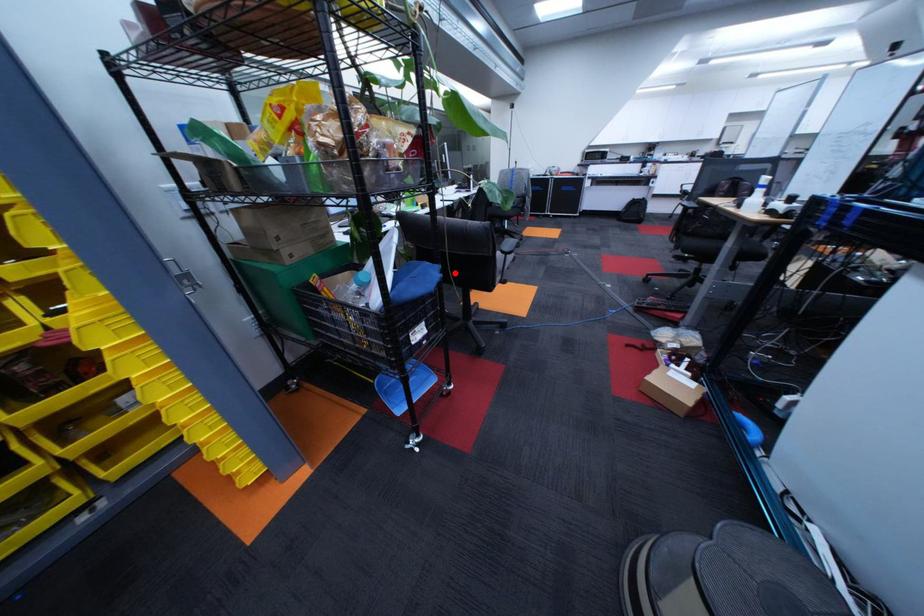
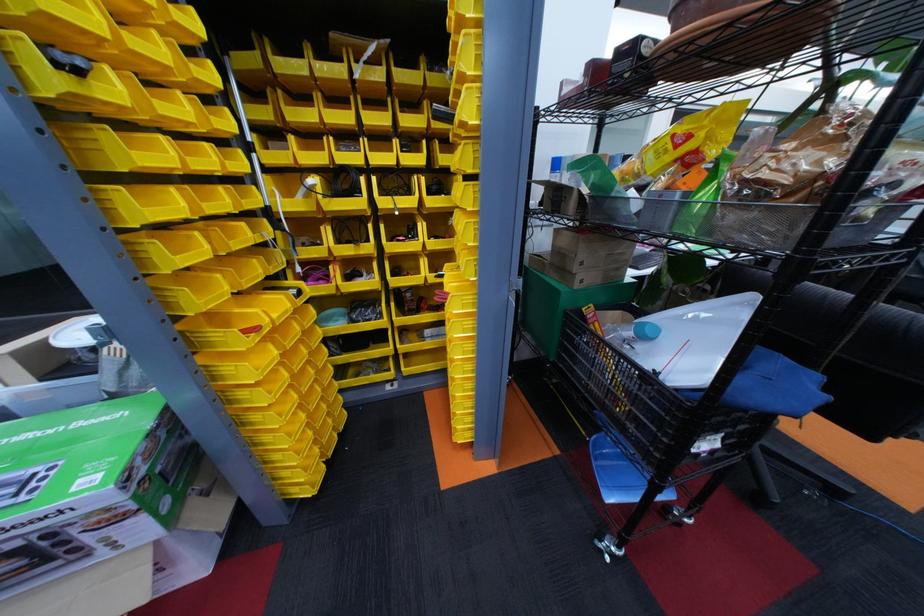
Find the pixel in the second image that matches the highlighted location in the first image.

(841, 391)